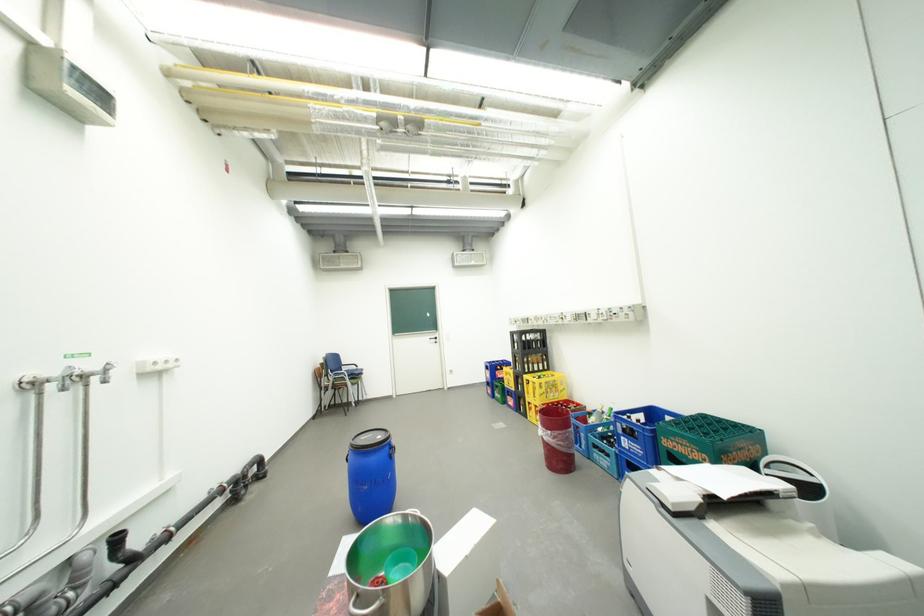
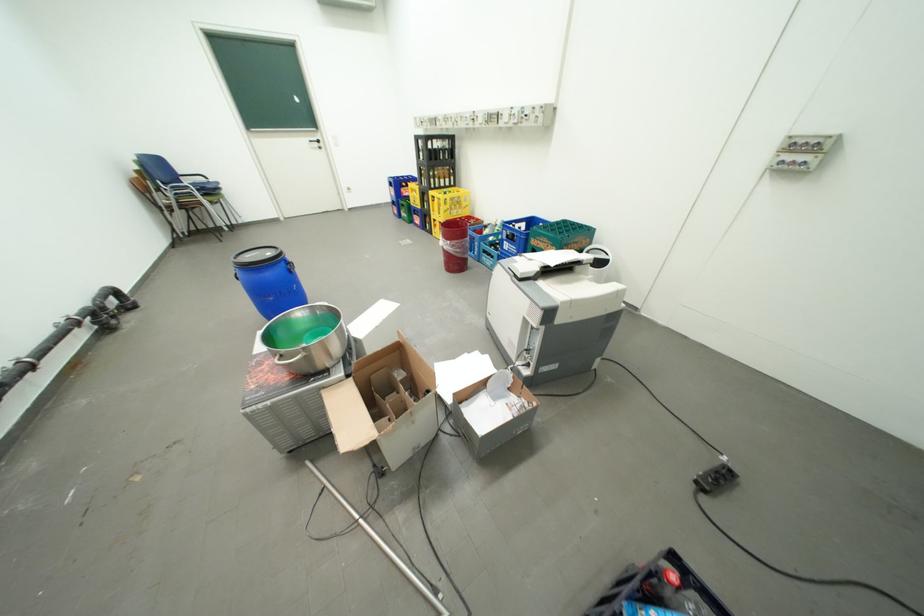
The point at (708, 451) is marked in the first image. Where is the corresponding point in the second image?

(562, 246)